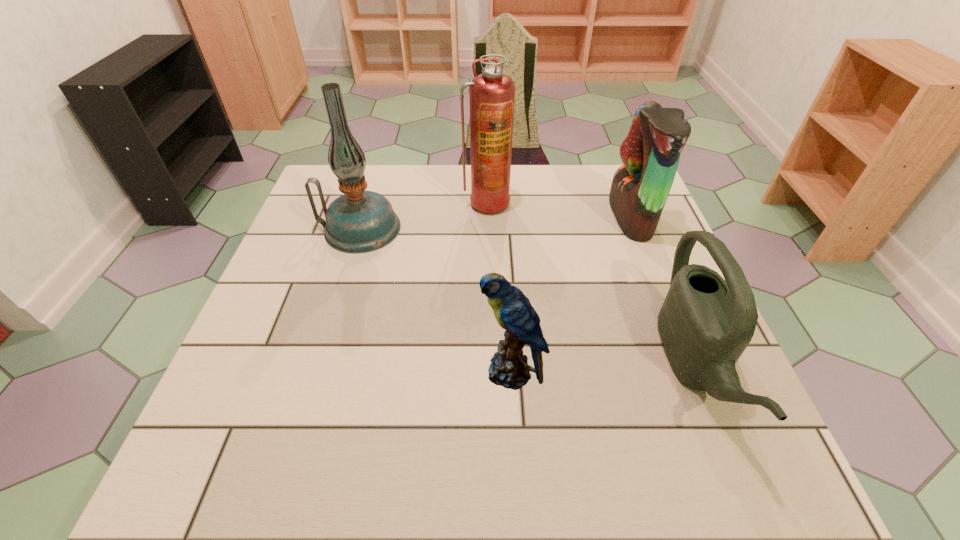
This screenshot has width=960, height=540. Identify the location of empty location between the oil lamp and the third tallest object. (495, 223).

Identify which object is the second nearest to the nearer parrot. Please provide its 2D coordinates. Your answer should be formatted as a tuple, i.e. [(x, y)], where the tuple contains the x and y coordinates of a point satisfying the conditions above.

[(359, 221)]

You are a GUI agent. You are given a task and a screenshot of the screen. Output one action in this format:
    pyautogui.click(x=<x>, y=<y>)
    Task: Click on the third closest object to the right parrot
    
    Given the screenshot: What is the action you would take?
    pyautogui.click(x=509, y=368)

I want to click on vacant region that satisfies the following two spatial constraints: 1. at the face of the right parrot; 2. on the front side of the leftmost object, so click(x=636, y=228).

The width and height of the screenshot is (960, 540). In order to click on free space that satisfies the following two spatial constraints: 1. at the face of the farther parrot; 2. on the front side of the leftmost object in this screenshot , I will do `click(636, 228)`.